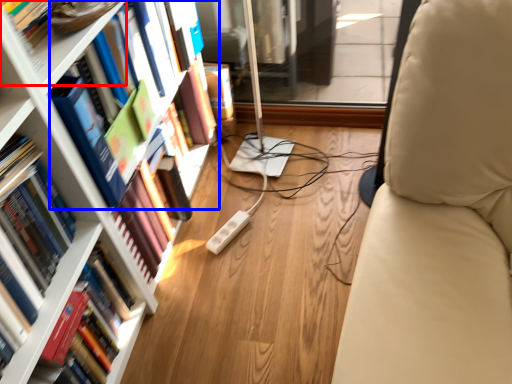
Question: Which point is closer to the camera, shelf (highlighted by a red box) or book (highlighted by a blue box)?

Choices:
 (A) shelf
 (B) book

Answer: (A)